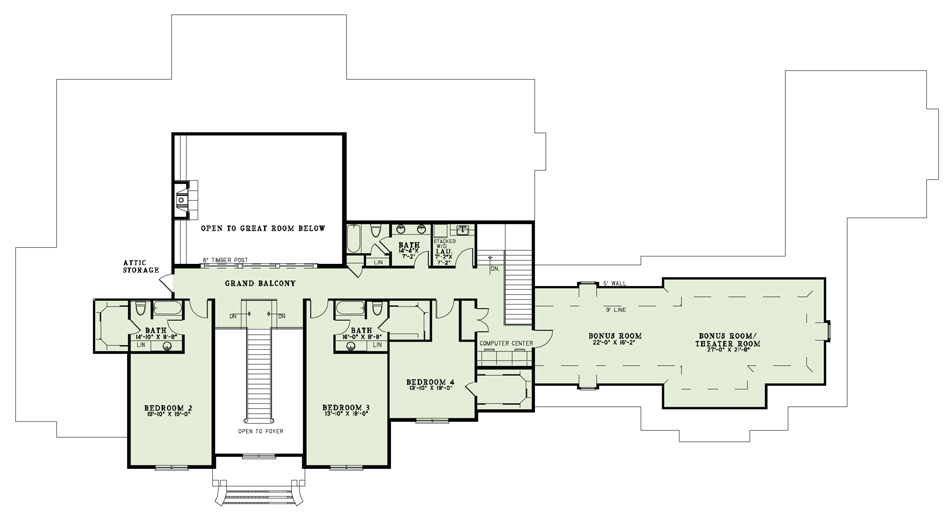
Locate an element on the screen. The height and width of the screenshot is (517, 950). toilet is located at coordinates (140, 309), (373, 234), (374, 308).